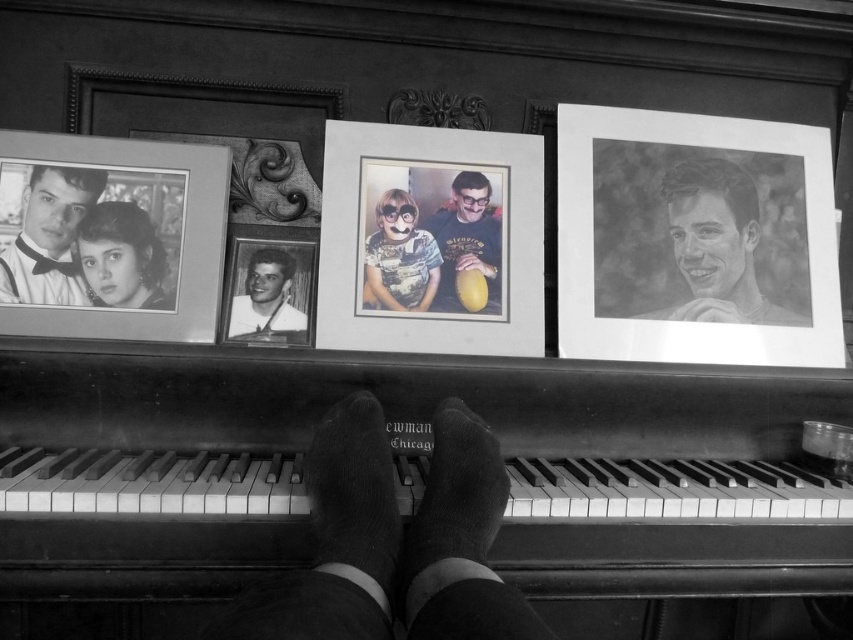
You are standing next to the camera in the scene. You want to pick up the matte black photo frame at center left without moving the camera. Is it possible to reach it while staying in place?

The matte black photo frame at center left and camera are 3.35 feet apart from each other. Since the distance is greater than the average human arm length, you cannot reach the matte black photo frame at center left without moving the camera.

Based on the photo, you are looking at the three framed photographs above the piano. There are two specific points marked on the leftmost photograph. The first point is at coordinates point (264, 237) and the second point is at point (469, 230). Which of these two points is closer to you?

Point (264, 237) is closer to you than point (469, 230) because it is further to the viewer according to the description.

You are a photographer who wants to capture a closeup of the black suede socks at center and the smooth black hair at left. Which object should you zoom in on to ensure it appears larger in the photo without moving the camera?

The smooth black hair at left should be zoomed in on because it is thicker than the black suede socks at center, so it will appear larger in the photo when zoomed in without moving the camera.